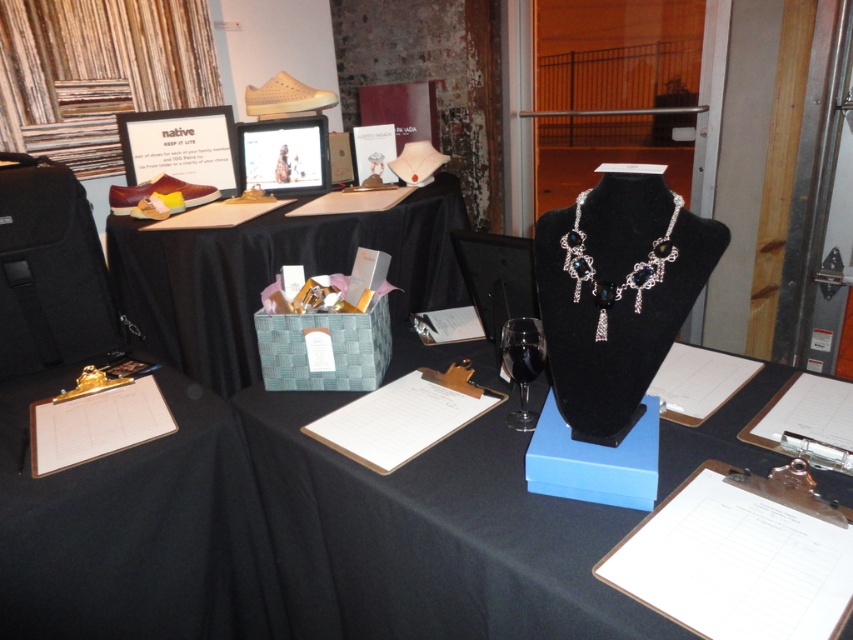
Is woven fabric basket at center wider than gold metal clipboard at lower left?

Yes.

Locate an element on the screen. woven fabric basket at center is located at coordinates (271, 275).

Is point (372, 440) farther from viewer compared to point (113, 436)?

That is False.

Who is lower down, white paper clipboard at center or gold metal clipboard at lower left?

Positioned lower is gold metal clipboard at lower left.

Is point (415, 372) more distant than point (119, 435)?

Yes, point (415, 372) is farther from viewer.

Where is `white paper clipboard at center`? The image size is (853, 640). white paper clipboard at center is located at coordinates (404, 417).

Is white wood clipboard at center above white paper clipboard at center?

No, white wood clipboard at center is not above white paper clipboard at center.

Between white wood clipboard at center and white paper clipboard at center, which one has less height?

Standing shorter between the two is white wood clipboard at center.

Between point (798, 586) and point (361, 461), which one is positioned in front?

Point (798, 586) is more forward.

You are a GUI agent. You are given a task and a screenshot of the screen. Output one action in this format:
    pyautogui.click(x=<x>, y=<y>)
    Task: Click on the white wood clipboard at center
    
    Given the screenshot: What is the action you would take?
    pyautogui.click(x=735, y=563)